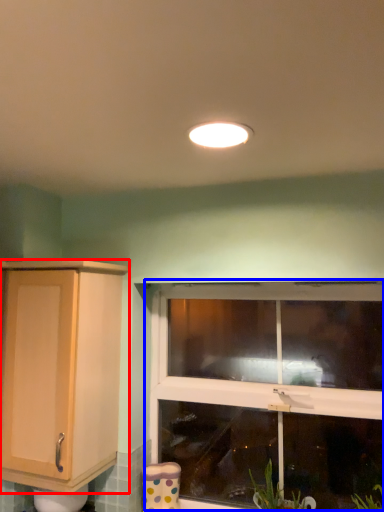
Question: Which object is closer to the camera taking this photo, cabinetry (highlighted by a red box) or window (highlighted by a blue box)?

Choices:
 (A) cabinetry
 (B) window

Answer: (A)